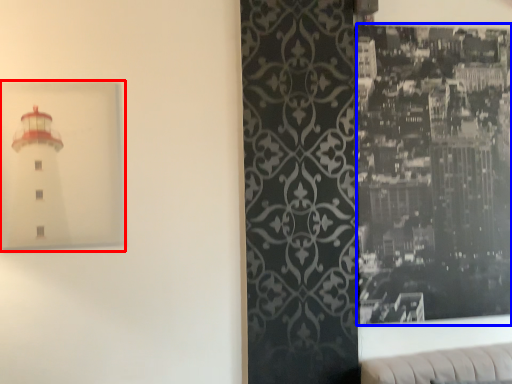
Question: Which point is further to the camera, picture frame (highlighted by a red box) or picture frame (highlighted by a blue box)?

Choices:
 (A) picture frame
 (B) picture frame

Answer: (B)